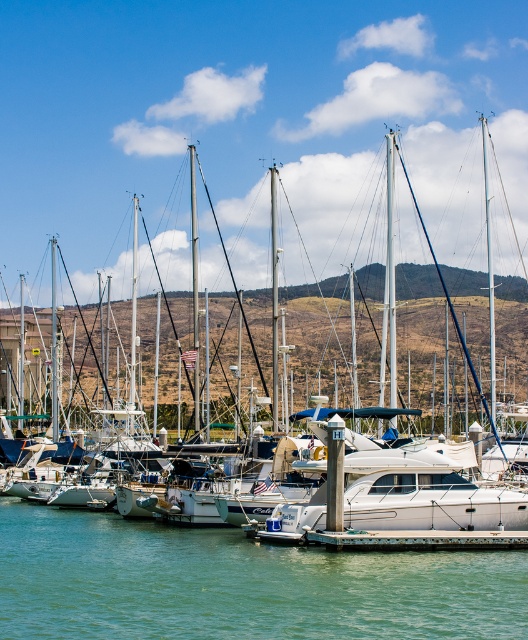
Question: Which point is farther from the camera taking this photo?

Choices:
 (A) (135, 314)
 (B) (523, 540)
 (C) (40, 554)

Answer: (A)

Question: Which point appears farthest from the camera in this image?

Choices:
 (A) (8, 593)
 (B) (343, 531)
 (C) (389, 508)

Answer: (C)

Question: Does green water at center have a greater width compared to white glossy sailboat at center?

Choices:
 (A) yes
 (B) no

Answer: (B)

Question: Observing the image, what is the correct spatial positioning of green water at center in reference to white glossy sailboat at center?

Choices:
 (A) above
 (B) below

Answer: (B)

Question: Does green water at center appear under rustic wood dock at center?

Choices:
 (A) yes
 (B) no

Answer: (A)

Question: Among these points, which one is farthest from the camera?

Choices:
 (A) (x=428, y=540)
 (B) (x=389, y=188)

Answer: (B)